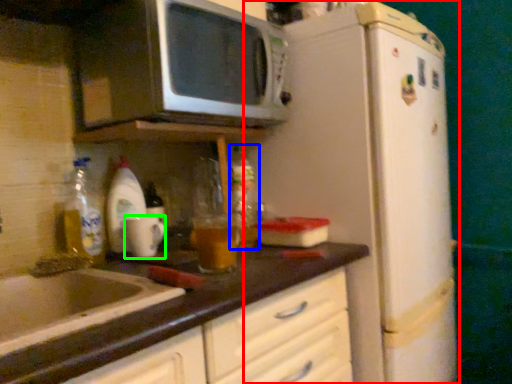
Question: Considering the real-world distances, which object is closest to refrigerator (highlighted by a red box)? bottle (highlighted by a blue box) or mug (highlighted by a green box).

Choices:
 (A) bottle
 (B) mug

Answer: (A)